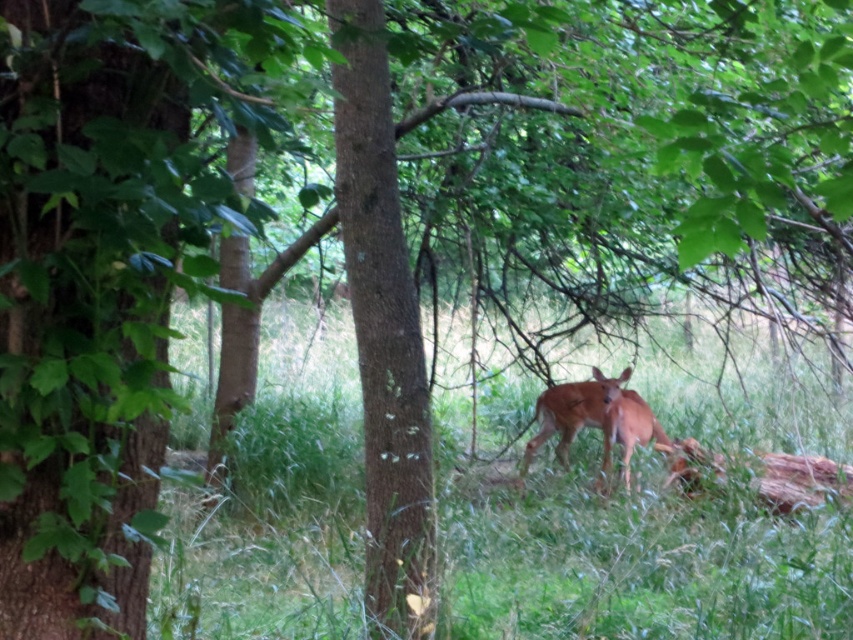
Who is taller, green grass at center or shiny brown deer at center?

With more height is green grass at center.

Is point (463, 400) behind point (631, 410)?

Yes, it is behind point (631, 410).

Find the location of a particular element. Image resolution: width=853 pixels, height=640 pixels. green grass at center is located at coordinates (625, 552).